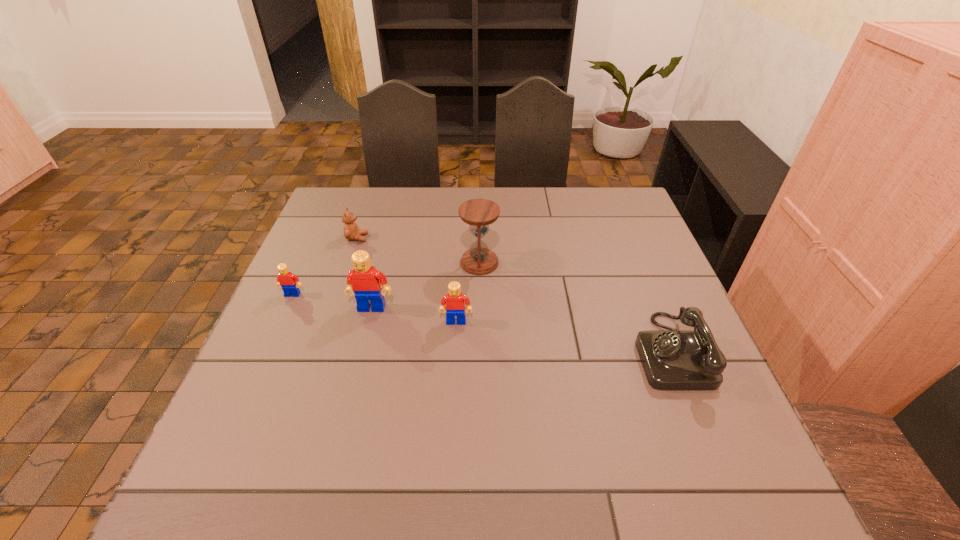
Identify the location of object that is at the right edge. (674, 360).

In the image, there is a desktop. Where is `free region at the far edge`? The image size is (960, 540). free region at the far edge is located at coordinates (494, 191).

The height and width of the screenshot is (540, 960). I want to click on vacant space at the near edge of the desktop, so [440, 417].

Locate an element on the screen. The width and height of the screenshot is (960, 540). vacant point at the left edge is located at coordinates (261, 385).

The image size is (960, 540). In the image, there is a desktop. What are the coordinates of `vacant space at the right edge` in the screenshot? It's located at (641, 312).

Identify the location of free space at the far left corner of the desktop. (342, 196).

In the image, there is a desktop. Where is `blank space at the near left corner`? The height and width of the screenshot is (540, 960). blank space at the near left corner is located at coordinates (222, 423).

In the image, there is a desktop. Identify the location of vacant space at the far right corner. This screenshot has height=540, width=960. (601, 199).

This screenshot has width=960, height=540. Identify the location of empty space that is in between the telephone and the third nearest object. (521, 329).

You are a GUI agent. You are given a task and a screenshot of the screen. Output one action in this format:
    pyautogui.click(x=<x>, y=<y>)
    Task: Click on the free spot between the second farthest object and the tallest Lego
    This screenshot has width=960, height=540.
    Given the screenshot: What is the action you would take?
    pyautogui.click(x=425, y=285)